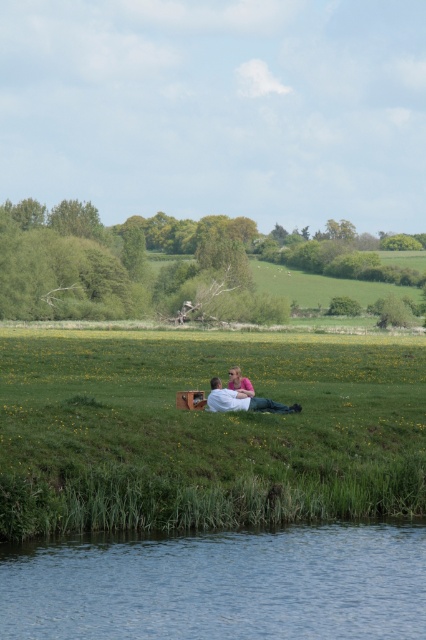
Question: Can you confirm if blue water at lower center is bigger than pink fabric at center?

Choices:
 (A) no
 (B) yes

Answer: (B)

Question: Can you confirm if blue water at lower center is thinner than white fabric at center?

Choices:
 (A) no
 (B) yes

Answer: (A)

Question: Which object appears farthest from the camera in this image?

Choices:
 (A) pink fabric at center
 (B) blue water at lower center
 (C) white fabric at center
 (D) green grassy hillside at center

Answer: (A)

Question: Which point appears closest to the camera in this image?

Choices:
 (A) (120, 486)
 (B) (238, 406)
 (C) (91, 611)

Answer: (C)

Question: Does blue water at lower center appear on the right side of pink fabric at center?

Choices:
 (A) no
 (B) yes

Answer: (B)

Question: Which point appears closest to the camera in this image?

Choices:
 (A) (97, 520)
 (B) (230, 385)

Answer: (A)